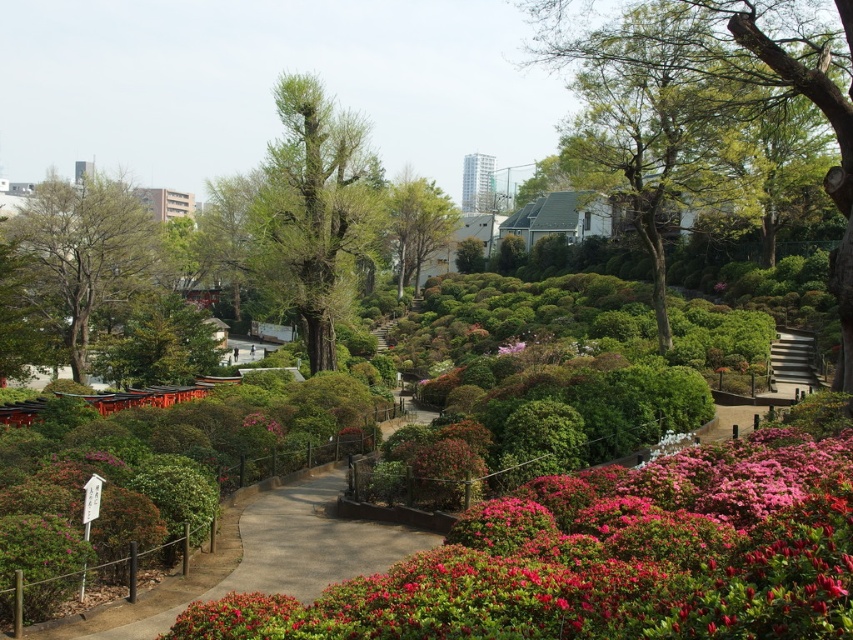
Question: Is green leafy tree at upper center closer to the viewer compared to pink matte flower at center?

Choices:
 (A) no
 (B) yes

Answer: (B)

Question: Which is farther from the green rough bark tree at left?

Choices:
 (A) green rough bark tree at center
 (B) pink glossy bush at lower left
 (C) green leafy tree at upper center
 (D) pink matte flower at center

Answer: (B)

Question: Can you confirm if green leafy bushes at center is positioned to the right of green leafy tree at upper center?

Choices:
 (A) no
 (B) yes

Answer: (A)

Question: Estimate the real-world distances between objects in this image. Which object is closer to the pink matte flower at center?

Choices:
 (A) green rough bark tree at center
 (B) green leafy tree at center

Answer: (A)

Question: Which object appears closest to the camera in this image?

Choices:
 (A) green rough bark tree at center
 (B) green leafy tree at upper center
 (C) green leafy tree at center
 (D) pink glossy bush at lower left

Answer: (D)

Question: Can you confirm if green leafy bushes at center is positioned above green leafy tree at center?

Choices:
 (A) yes
 (B) no

Answer: (B)